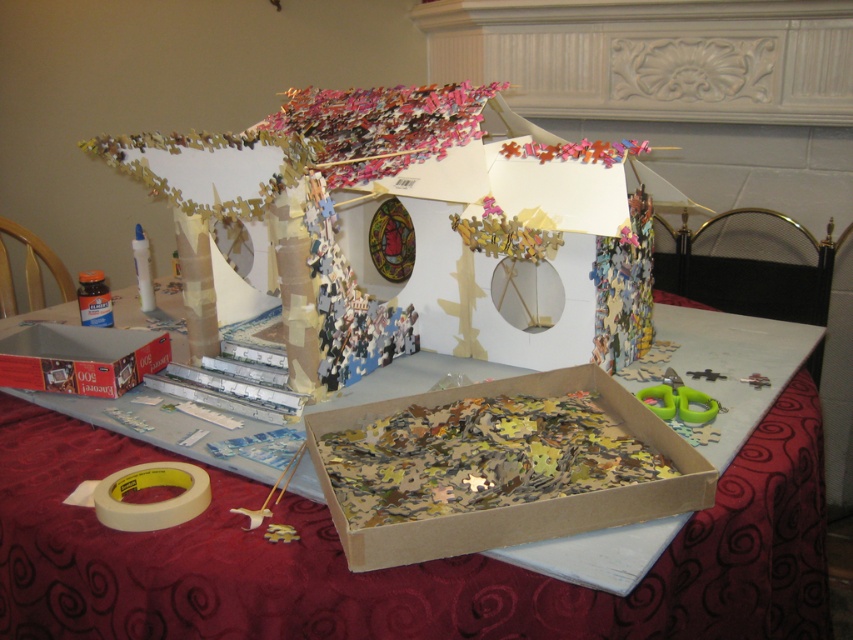
You are trying to assemble the puzzle house and need to place the cardboard puzzle pieces at center into the metallic cardboard box at lower left. Can you move them directly to the box without moving any other objects?

The cardboard puzzle pieces at center is to the right of the metallic cardboard box at lower left, so you can move them directly to the box without moving other objects since they are adjacent.

You are trying to complete the puzzle house and need to choose between the wooden puzzle pieces at center and the cardboard puzzle pieces at center. Which type of puzzle pieces are larger in size?

The wooden puzzle pieces at center are bigger than the cardboard puzzle pieces at center, so you should choose the wooden puzzle pieces at center for a better fit.

You are a puzzle assembler working on the puzzle house. You notice a point marked at coordinates (498, 467). Where is this point located in relation to the puzzle house?

The point at (498, 467) is located on the cardboard puzzle pieces at the center of the puzzle house.